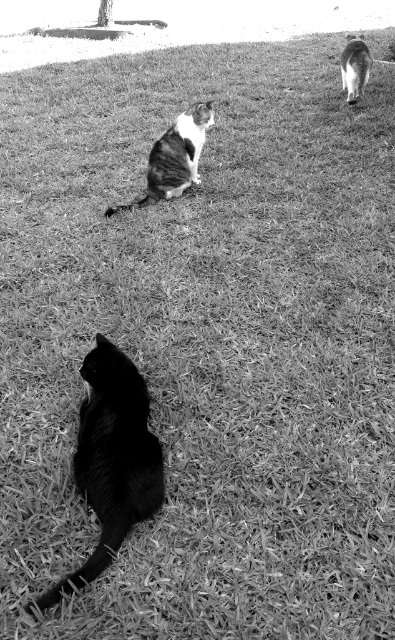
Question: Which point is closer to the camera?

Choices:
 (A) soft fur cat at upper right
 (B) black fur cat at lower left

Answer: (B)

Question: Is black fur cat at lower left positioned at the back of striped fur cat at center?

Choices:
 (A) yes
 (B) no

Answer: (B)

Question: Which object appears closest to the camera in this image?

Choices:
 (A) soft fur cat at upper right
 (B) black fur cat at lower left

Answer: (B)

Question: Which of the following is the closest to the observer?

Choices:
 (A) striped fur cat at center
 (B) black fur cat at lower left

Answer: (B)

Question: Can you confirm if black fur cat at lower left is bigger than soft fur cat at upper right?

Choices:
 (A) no
 (B) yes

Answer: (A)

Question: Does striped fur cat at center appear on the left side of soft fur cat at upper right?

Choices:
 (A) yes
 (B) no

Answer: (A)